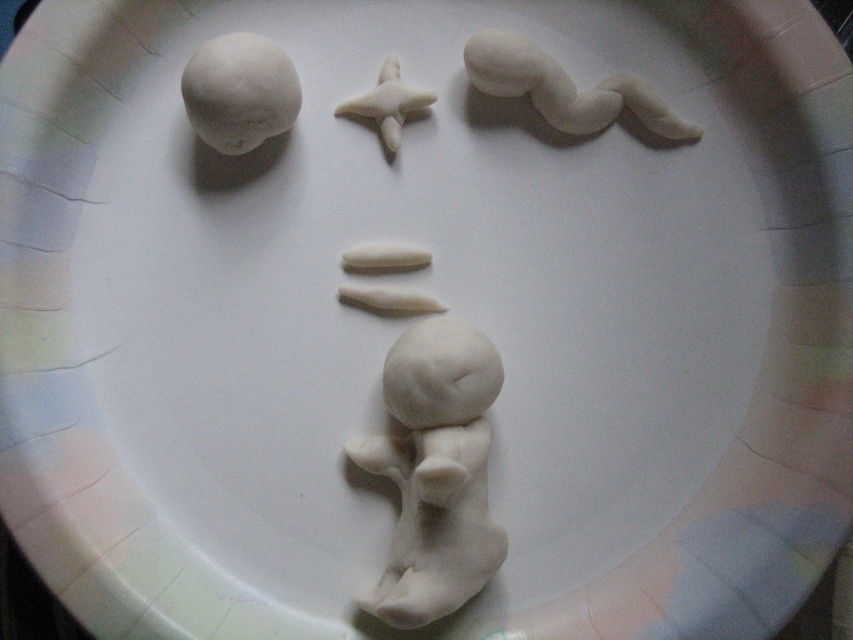
Question: Does white clay figure at center appear on the right side of white matte clay head at upper left?

Choices:
 (A) no
 (B) yes

Answer: (B)

Question: Which object is farther from the camera taking this photo?

Choices:
 (A) white clay figure at center
 (B) white matte clay head at upper left
 (C) white matte cylinder at center

Answer: (C)

Question: Is white clay figure at center closer to the viewer compared to white matte clay head at upper left?

Choices:
 (A) yes
 (B) no

Answer: (A)

Question: Does white clay figure at center appear on the right side of white matte clay worm at upper right?

Choices:
 (A) yes
 (B) no

Answer: (B)

Question: Estimate the real-world distances between objects in this image. Which object is closer to the white matte cylinder at center?

Choices:
 (A) white clay figure at center
 (B) white clay shark fin at upper center

Answer: (B)

Question: Which point is farther to the camera?

Choices:
 (A) white clay figure at center
 (B) white matte clay worm at upper right
 (C) white clay shark fin at upper center

Answer: (C)